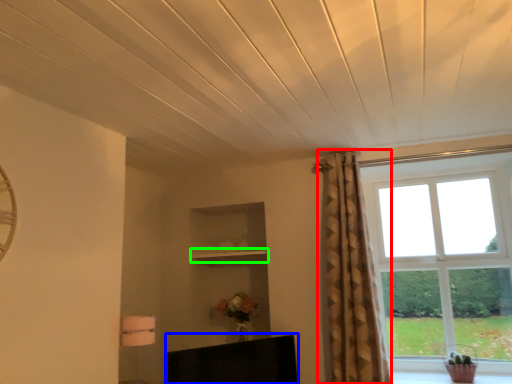
Question: Based on their relative distances, which object is nearer to curtain (highlighted by a red box)? Choose from furniture (highlighted by a blue box) and shelf (highlighted by a green box).

Choices:
 (A) furniture
 (B) shelf

Answer: (A)